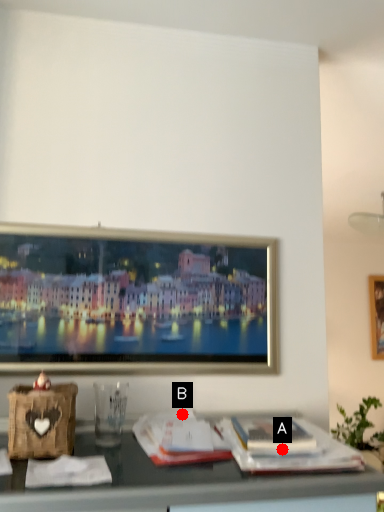
Question: Two points are circled on the image, labeled by A and B beside each circle. Which point is closer to the camera?

Choices:
 (A) A is closer
 (B) B is closer

Answer: (A)